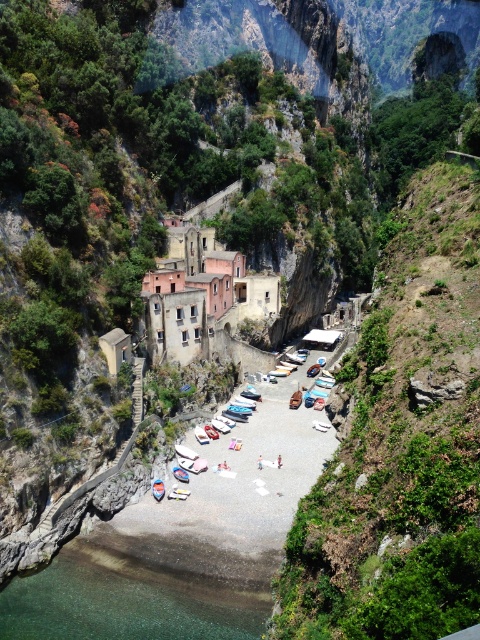
You are a photographer standing on the beach and want to capture both the white glossy boat at center and the light blue denim shorts at center in a single frame. Which object will appear larger in your photo?

The white glossy boat at center will appear larger in the photo because it is much taller than the light blue denim shorts at center.

Based on the photo, you are a photographer planning to capture a wide shot of the coastal scene. You need to ensure that both the white glossy boat at center and the light blue denim shorts at center are fully visible in your frame. Based on their sizes, is there a risk that one might be partially cut off if the other is centered?

The white glossy boat at center might be wider than light blue denim shorts at center, so there is a risk that the light blue denim shorts at center could be partially cut off if the boat is centered in the frame.

You are a photographer planning to capture the white glossy boat at center and the clear glass water at lower left in a single frame. Which object will occupy more space in your photo if you focus on both?

The clear glass water at lower left is bigger than the white glossy boat at center, so it will occupy more space in the photo.